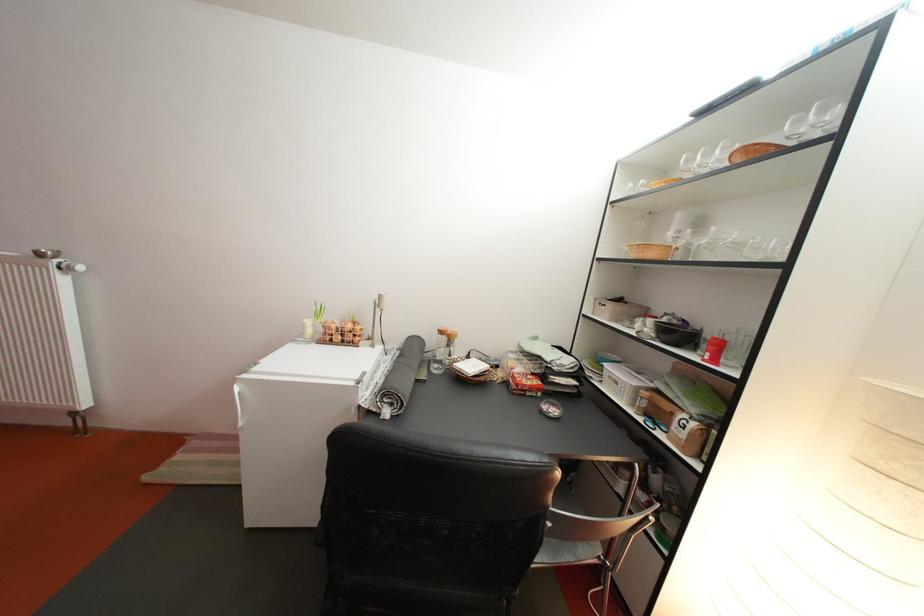
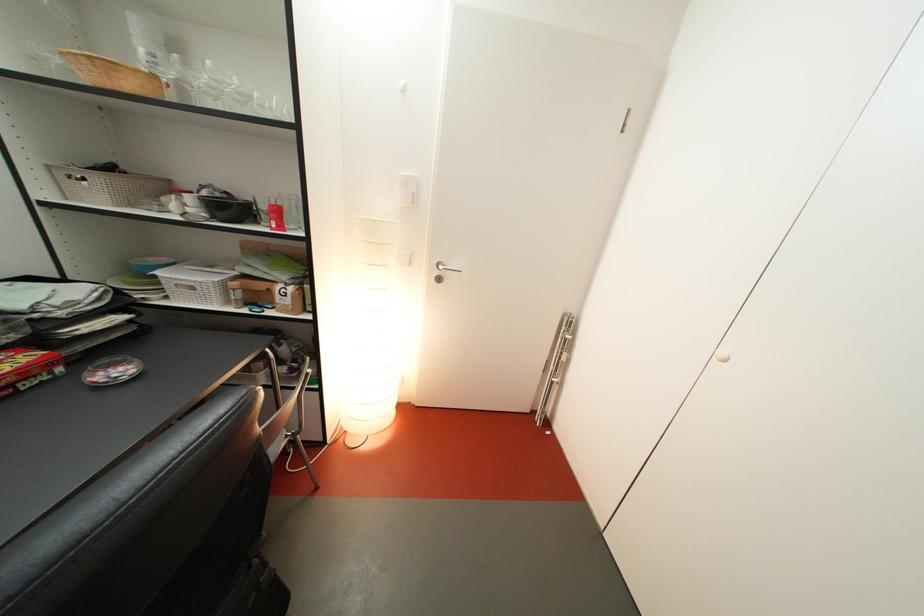
In the second image, find the point that corresponds to pixel 546 389 in the first image.

(38, 363)